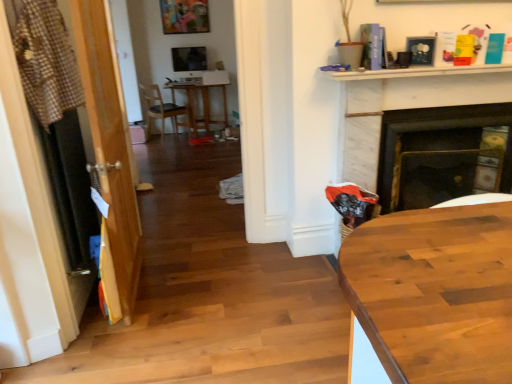
Question: From the image's perspective, relative to wooden door at left, is satin black monitor at center above or below?

Choices:
 (A) below
 (B) above

Answer: (B)

Question: Looking at the image, does satin black monitor at center seem bigger or smaller compared to wooden door at left?

Choices:
 (A) big
 (B) small

Answer: (B)

Question: Estimate the real-world distances between objects in this image. Which object is closer to the matte wood chair at center?

Choices:
 (A) matte black picture frame at upper right
 (B) checkered fabric laundry at left
 (C) black marble fireplace at center-right
 (D) satin black monitor at center
 (E) wooden door at left

Answer: (D)

Question: Considering the real-world distances, which object is farthest from the checkered fabric laundry at left?

Choices:
 (A) satin black monitor at center
 (B) black marble fireplace at center-right
 (C) wooden door at left
 (D) matte wood chair at center
 (E) matte black picture frame at upper right

Answer: (A)